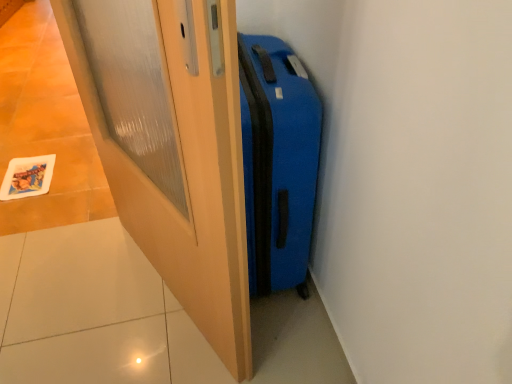
I want to click on free space that is to the left of matte wood door at center, so click(80, 291).